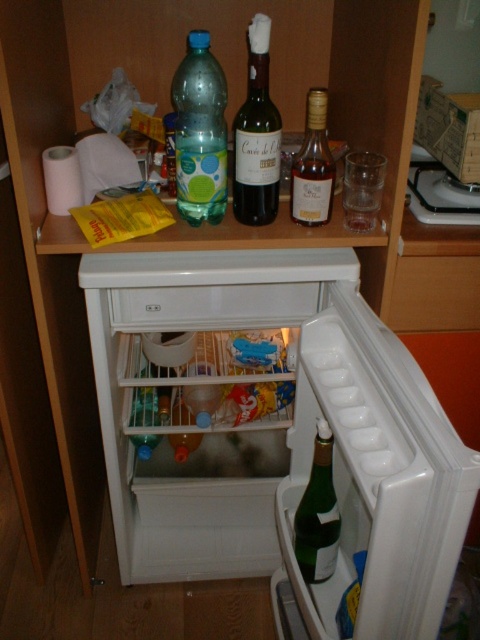
You are organizing items on a kitchen shelf and need to place both the translucent plastic bottle at upper center and the translucent glass bottle at upper center. If you want to maximize space efficiency, which bottle should you place first?

The translucent plastic bottle at upper center is bigger than the translucent glass bottle at upper center, so to maximize space efficiency, you should place the translucent plastic bottle at upper center first to ensure it fits properly before placing the smaller one.

You are trying to place a new item on the refrigerator shelf where the translucent plastic bottle at upper center and the translucent glass bottle at upper center are located. If your new item is 10 cm wide, can it fit next to both bottles without moving them?

The translucent plastic bottle at upper center is wider than the translucent glass bottle at upper center. Since the plastic bottle is already taking up more space, there might not be enough room for the 10 cm wide item next to both bottles without moving them. You should check the available space carefully.